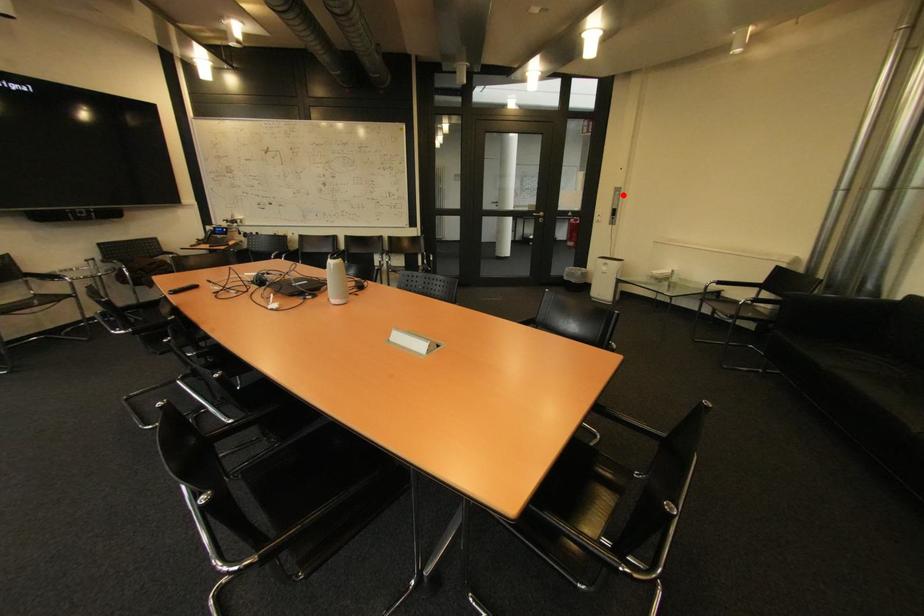
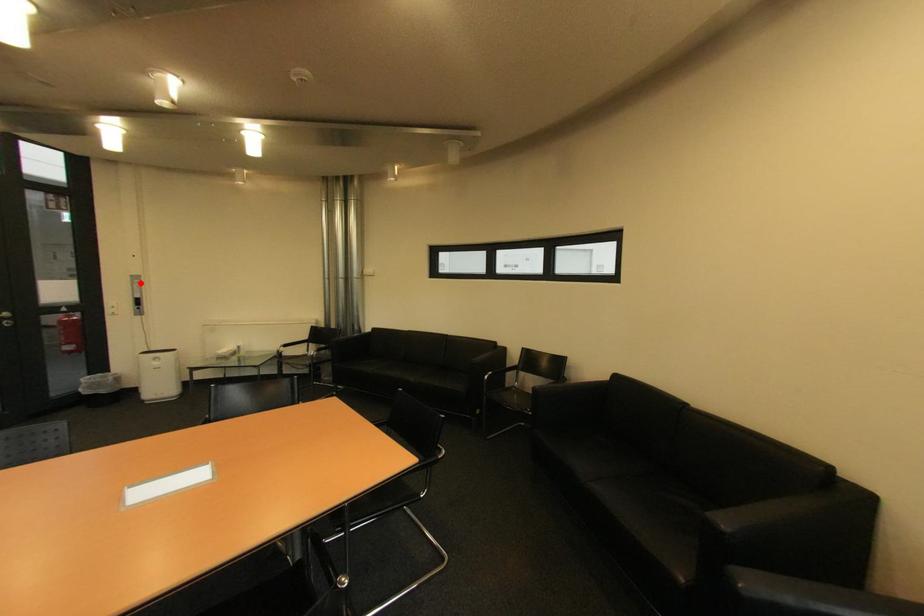
I am providing you with two images of the same scene from different viewpoints. A red point is marked on the first image and another point is marked on the second image. Is the red point in image1 aligned with the point shown in image2?

Yes